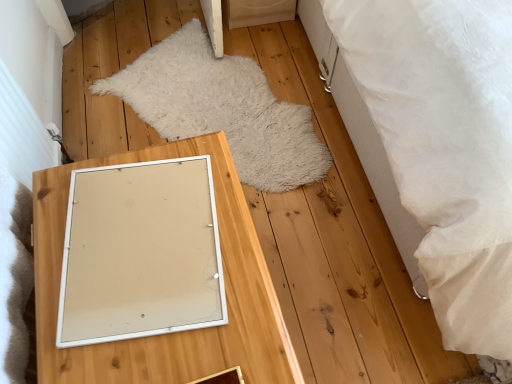
Question: Can you see white textured bed at right touching white matte picture frame at center?

Choices:
 (A) no
 (B) yes

Answer: (A)

Question: Are white textured bed at right and white matte picture frame at center located far from each other?

Choices:
 (A) no
 (B) yes

Answer: (A)

Question: Does white textured bed at right have a larger size compared to white matte picture frame at center?

Choices:
 (A) no
 (B) yes

Answer: (B)

Question: From the image's perspective, is white textured bed at right located above white matte picture frame at center?

Choices:
 (A) no
 (B) yes

Answer: (B)

Question: Does white textured bed at right have a lesser width compared to white matte picture frame at center?

Choices:
 (A) yes
 (B) no

Answer: (B)

Question: Considering the relative sizes of white textured bed at right and white matte picture frame at center in the image provided, is white textured bed at right wider than white matte picture frame at center?

Choices:
 (A) yes
 (B) no

Answer: (A)

Question: Does white textured bed at right have a lesser width compared to wooden mirror at center?

Choices:
 (A) no
 (B) yes

Answer: (A)

Question: Is white textured bed at right behind wooden mirror at center?

Choices:
 (A) no
 (B) yes

Answer: (A)

Question: Is white textured bed at right at the left side of wooden mirror at center?

Choices:
 (A) yes
 (B) no

Answer: (B)

Question: Could wooden mirror at center be considered to be inside white textured bed at right?

Choices:
 (A) yes
 (B) no

Answer: (B)

Question: Can you confirm if white textured bed at right is smaller than wooden mirror at center?

Choices:
 (A) yes
 (B) no

Answer: (B)

Question: Could you tell me if white textured bed at right is facing wooden mirror at center?

Choices:
 (A) yes
 (B) no

Answer: (B)

Question: Could you tell me if white fluffy rug at center is facing white matte picture frame at center?

Choices:
 (A) no
 (B) yes

Answer: (A)